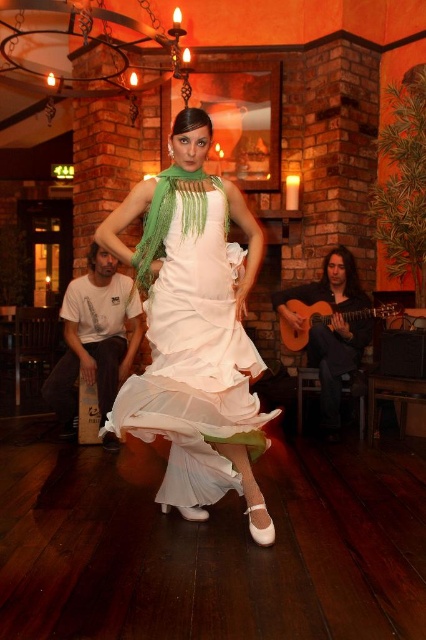
Question: Which of the following is the farthest from the observer?

Choices:
 (A) (296, 346)
 (B) (210, 396)

Answer: (A)

Question: Is white satin dress at center to the right of acoustic wood guitar at right from the viewer's perspective?

Choices:
 (A) yes
 (B) no

Answer: (B)

Question: Is white satin dress at center smaller than acoustic wood guitar at right?

Choices:
 (A) no
 (B) yes

Answer: (A)

Question: Is white satin dress at center behind acoustic wood guitar at right?

Choices:
 (A) yes
 (B) no

Answer: (B)

Question: Which point is closer to the camera?

Choices:
 (A) (377, 317)
 (B) (233, 420)

Answer: (B)